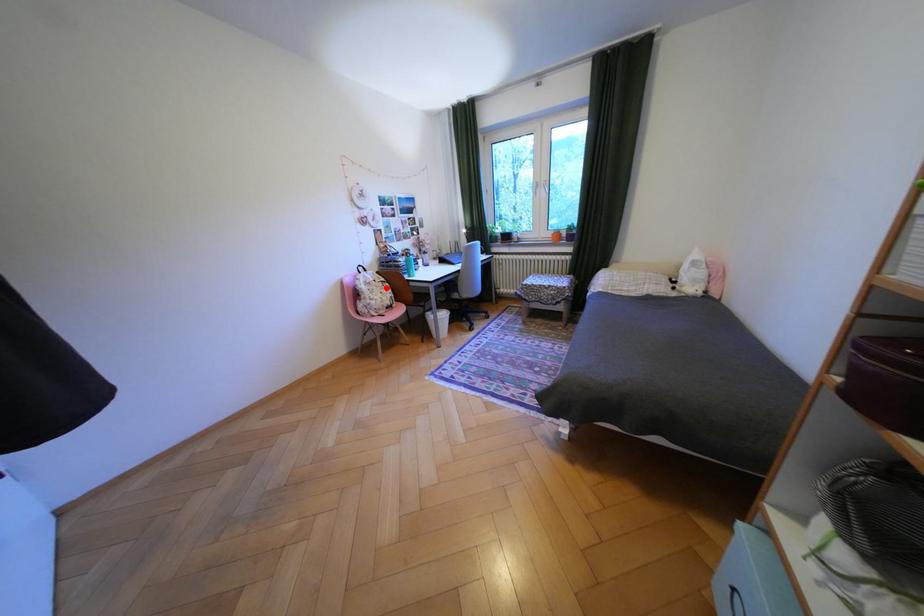
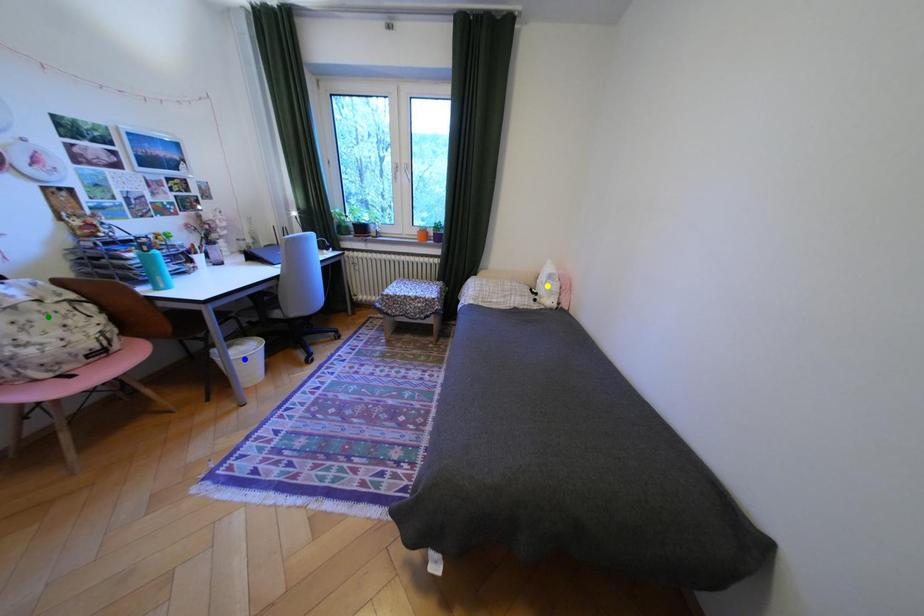
Question: I am providing you with two images of the same scene from different viewpoints. A red point is marked on the first image. You are given multiple points on the second image. Can you choose the point in image 2 that corresponds to the point in image 1?

Choices:
 (A) blue point
 (B) yellow point
 (C) green point

Answer: (C)